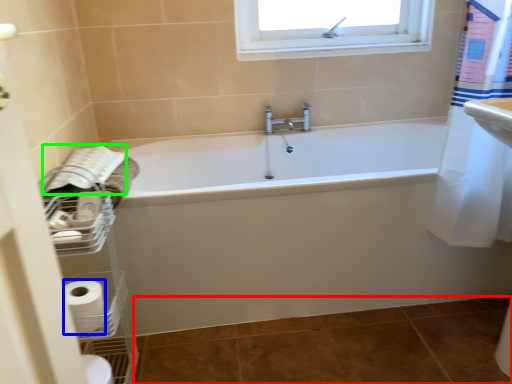
Question: Based on their relative distances, which object is nearer to ceramic tile (highlighted by a red box)? Choose from toilet paper (highlighted by a blue box) and bath towel (highlighted by a green box).

Choices:
 (A) toilet paper
 (B) bath towel

Answer: (A)